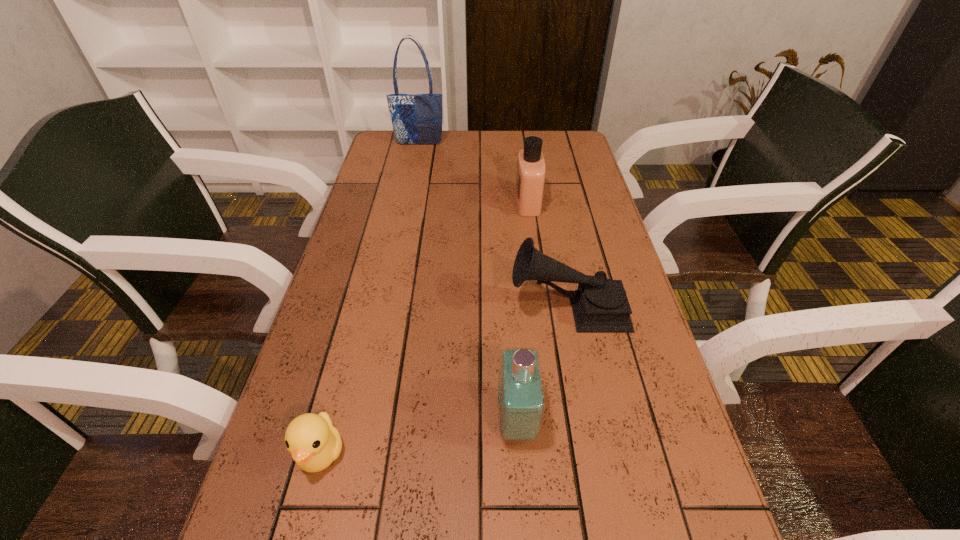
Where is `the farthest object`? This screenshot has height=540, width=960. the farthest object is located at coordinates (417, 119).

The image size is (960, 540). Identify the location of the tallest object. (417, 119).

Where is `the farther perfume`? the farther perfume is located at coordinates (530, 177).

Find the location of a particular element. the right perfume is located at coordinates (530, 177).

In order to click on the left perfume in this screenshot , I will do `click(521, 397)`.

Locate an element on the screen. This screenshot has width=960, height=540. phonograph_record is located at coordinates (599, 304).

At what (x,y) coordinates should I click in order to perform the action: click on duck. Please return your answer as a coordinate pair (x, y). The width and height of the screenshot is (960, 540). Looking at the image, I should click on (314, 443).

This screenshot has height=540, width=960. What are the coordinates of `free space located 0.220m on the front-facing side of the shopping bag` in the screenshot? It's located at (412, 179).

This screenshot has width=960, height=540. What are the coordinates of `vacant space located on the front label of the right perfume` in the screenshot? It's located at coord(421,202).

At what (x,y) coordinates should I click in order to perform the action: click on free space located 0.300m on the front label of the right perfume. Please return your answer as a coordinate pair (x, y). The width and height of the screenshot is (960, 540). Looking at the image, I should click on (418, 202).